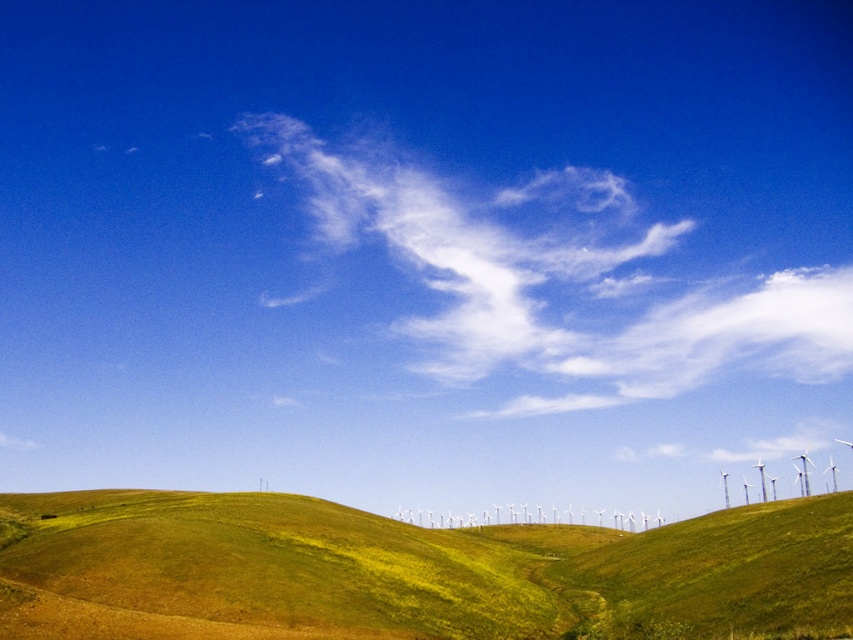
You are standing on the green grassy hillside at lower center and looking up at the white cotton cloud at upper center. Which object is closer to the ground?

The green grassy hillside at lower center is closer to the ground than the white cotton cloud at upper center.

From the picture: You are an artist planning to paint the scene. You want to ensure the white cotton cloud at upper center and the white plastic wind turbines at center are proportionally accurate. Which object should you paint larger?

The white cotton cloud at upper center should be painted larger since it has a larger size compared to the white plastic wind turbines at center according to the description.